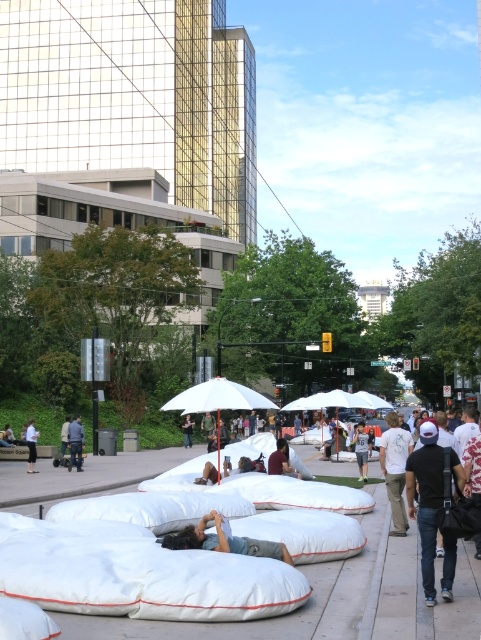
Does matte black cap at center appear under white cotton shirt at center?

Actually, matte black cap at center is above white cotton shirt at center.

Which of these two, matte black cap at center or white cotton shirt at center, stands shorter?

white cotton shirt at center

Which is in front, point (429, 595) or point (29, 472)?

Point (429, 595) is in front.

This screenshot has width=481, height=640. What are the coordinates of `matte black cap at center` in the screenshot? It's located at (429, 496).

From the picture: Is denim jacket at lower left above gray cotton t-shirt at center?

Yes.

Is point (72, 444) more distant than point (363, 451)?

Yes, it is behind point (363, 451).

Identify the location of denim jacket at lower left. (75, 442).

Can you confirm if white cotton t-shirt at center-right is wider than gray cotton t-shirt at center?

No, white cotton t-shirt at center-right is not wider than gray cotton t-shirt at center.

Identify the location of white cotton t-shirt at center-right. (394, 468).

This screenshot has width=481, height=640. What are the coordinates of `white cotton t-shirt at center-right` in the screenshot? It's located at (394, 468).